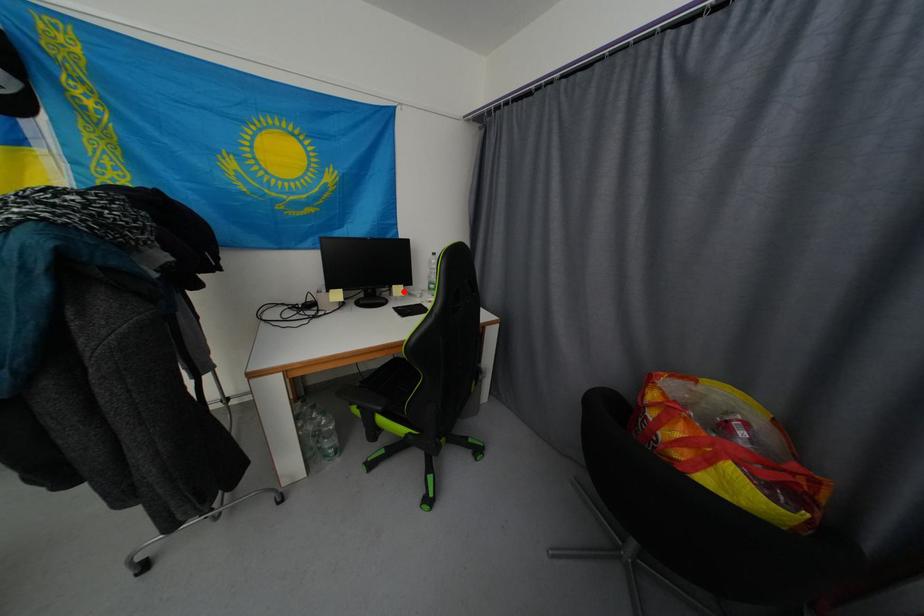
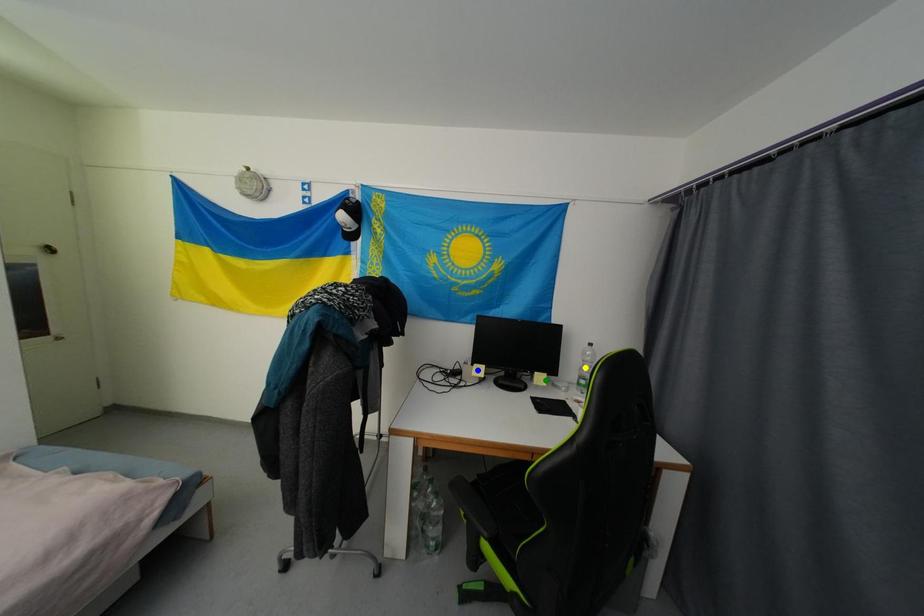
Question: I am providing you with two images of the same scene from different viewpoints. A red point is marked on the first image. You are given multiple points on the second image. In image 2, which mark is for the same physical point as the one in image 1?

Choices:
 (A) blue point
 (B) yellow point
 (C) green point

Answer: (C)